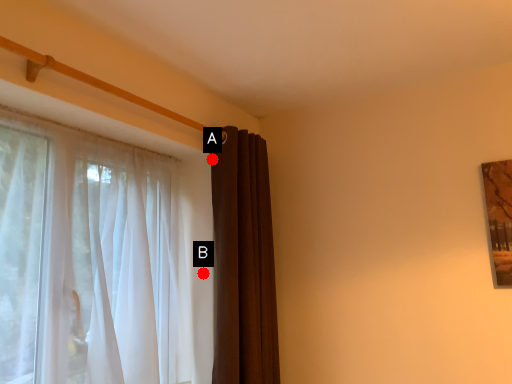
Question: Two points are circled on the image, labeled by A and B beside each circle. Which point appears farthest from the camera in this image?

Choices:
 (A) A is further
 (B) B is further

Answer: (A)